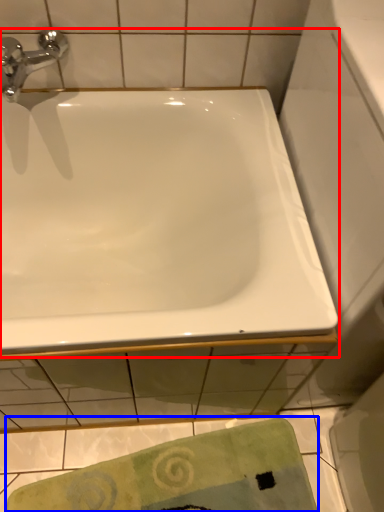
Question: Which point is further to the camera, bathtub (highlighted by a red box) or beach towel (highlighted by a blue box)?

Choices:
 (A) bathtub
 (B) beach towel

Answer: (B)